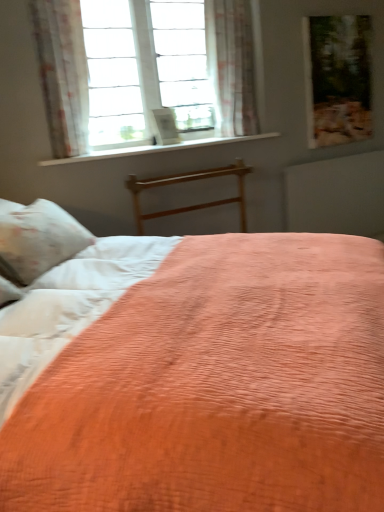
What do you see at coordinates (338, 79) in the screenshot? The height and width of the screenshot is (512, 384). I see `wooden picture frame at upper right` at bounding box center [338, 79].

Describe the element at coordinates (232, 65) in the screenshot. I see `sheer floral fabric at upper center, arranged as the 1th curtain when viewed from the right` at that location.

The width and height of the screenshot is (384, 512). Describe the element at coordinates (336, 192) in the screenshot. I see `coral quilted bed at center` at that location.

What do you see at coordinates (154, 149) in the screenshot? The height and width of the screenshot is (512, 384). I see `white smooth window sill at upper center` at bounding box center [154, 149].

Identify the location of wooden picture frame at upper right. (x=338, y=79).

Is sheer floral fabric at upper center, marked as the 2th curtain in a front-to-back arrangement, positioned with its back to matte wood radiator at upper right?

sheer floral fabric at upper center, marked as the 2th curtain in a front-to-back arrangement, does not have its back to matte wood radiator at upper right.

Between sheer floral fabric at upper center, arranged as the 1th curtain when viewed from the right, and matte wood radiator at upper right, which one appears on the right side from the viewer's perspective?

Positioned to the right is matte wood radiator at upper right.

Find the location of a particular element. This screenshot has height=512, width=384. radiator that appears below the sheer floral fabric at upper center, arranged as the 1th curtain when viewed from the right (from a real-world perspective) is located at coordinates (337, 195).

Is point (234, 124) more distant than point (366, 181)?

No.

Is coral quilted bed at center not near wooden bed frame at center?

No, there isn't a large distance between coral quilted bed at center and wooden bed frame at center.

Consider the image. How different are the orientations of coral quilted bed at center and wooden bed frame at center in degrees?

There is a 45.7-degree angle between the facing directions of coral quilted bed at center and wooden bed frame at center.

From the image's perspective, is coral quilted bed at center located beneath wooden bed frame at center?

Correct, coral quilted bed at center appears lower than wooden bed frame at center in the image.

Is coral quilted bed at center bigger than wooden bed frame at center?

Indeed, coral quilted bed at center has a larger size compared to wooden bed frame at center.

Could you measure the distance between matte wood radiator at upper right and sheer floral fabric at upper center, placed as the 1th curtain when sorted from back to front?

A distance of 34.43 inches exists between matte wood radiator at upper right and sheer floral fabric at upper center, placed as the 1th curtain when sorted from back to front.

Does point (297, 166) come behind point (227, 115)?

Yes, point (297, 166) is farther from viewer.

How many degrees apart are the facing directions of matte wood radiator at upper right and sheer floral fabric at upper center, which is counted as the 2th curtain, starting from the left?

The angular difference between matte wood radiator at upper right and sheer floral fabric at upper center, which is counted as the 2th curtain, starting from the left, is 0.00337 degrees.

Considering the relative sizes of matte wood radiator at upper right and sheer floral fabric at upper center, placed as the 1th curtain when sorted from back to front, in the image provided, is matte wood radiator at upper right thinner than sheer floral fabric at upper center, placed as the 1th curtain when sorted from back to front,?

Correct, the width of matte wood radiator at upper right is less than that of sheer floral fabric at upper center, placed as the 1th curtain when sorted from back to front.

Does matte wood radiator at upper right touch floral sheer curtain at upper left, which is the 2th curtain in right-to-left order?

No.

Is point (306, 208) closer to viewer compared to point (67, 60)?

No.

From the picture: Does matte wood radiator at upper right come in front of floral sheer curtain at upper left, which is the first curtain from front to back?

No, matte wood radiator at upper right is behind floral sheer curtain at upper left, which is the first curtain from front to back.

Is white smooth window sill at upper center not close to matte wood radiator at upper right?

No, white smooth window sill at upper center is in close proximity to matte wood radiator at upper right.

Can you confirm if white smooth window sill at upper center is positioned to the right of matte wood radiator at upper right?

Incorrect, white smooth window sill at upper center is not on the right side of matte wood radiator at upper right.

Is white smooth window sill at upper center turned away from matte wood radiator at upper right?

No.

Is wooden bed frame at center completely or partially inside floral sheer curtain at upper left, which is counted as the second curtain, starting from the back?

No, wooden bed frame at center is not surrounded by floral sheer curtain at upper left, which is counted as the second curtain, starting from the back.

In the scene shown: Is floral sheer curtain at upper left, which is the 2th curtain in right-to-left order, to the left or to the right of wooden bed frame at center in the image?

Clearly, floral sheer curtain at upper left, which is the 2th curtain in right-to-left order, is on the left of wooden bed frame at center in the image.

Looking at this image, from a real-world perspective, is floral sheer curtain at upper left, which is the 2th curtain in right-to-left order, on top of wooden bed frame at center?

Yes, from a real-world perspective, floral sheer curtain at upper left, which is the 2th curtain in right-to-left order, is on top of wooden bed frame at center.

Locate an element on the screen. The image size is (384, 512). bed frame below the floral sheer curtain at upper left, which is the 1th curtain in left-to-right order (from a real-world perspective) is located at coordinates (186, 182).

Is white smooth window sill at upper center shorter than floral sheer curtain at upper left, which is counted as the second curtain, starting from the back?

Yes.

Is white smooth window sill at upper center beside floral sheer curtain at upper left, which is the 2th curtain in right-to-left order?

white smooth window sill at upper center is not next to floral sheer curtain at upper left, which is the 2th curtain in right-to-left order, and they're not touching.

Is point (232, 139) closer or farther from the camera than point (39, 31)?

Clearly, point (232, 139) is more distant from the camera than point (39, 31).

Considering the sizes of objects white smooth window sill at upper center and floral sheer curtain at upper left, which is the first curtain from front to back, in the image provided, who is bigger, white smooth window sill at upper center or floral sheer curtain at upper left, which is the first curtain from front to back,?

floral sheer curtain at upper left, which is the first curtain from front to back, is bigger.

I want to click on radiator behind the sheer floral fabric at upper center, arranged as the 1th curtain when viewed from the right, so click(337, 195).

I want to click on bed above the wooden bed frame at center (from a real-world perspective), so click(x=336, y=192).

Based on their spatial positions, is matte wood radiator at upper right or wooden bed frame at center further from floral sheer curtain at upper left, which is the 2th curtain in right-to-left order?

The object further to floral sheer curtain at upper left, which is the 2th curtain in right-to-left order, is matte wood radiator at upper right.

Considering their positions, is wooden bed frame at center positioned further to sheer floral fabric at upper center, placed as the 1th curtain when sorted from back to front, than coral quilted bed at center?

coral quilted bed at center is positioned further to the anchor sheer floral fabric at upper center, placed as the 1th curtain when sorted from back to front.

Looking at the image, which one is located closer to coral quilted bed at center, white smooth window sill at upper center or floral sheer curtain at upper left, which is counted as the second curtain, starting from the back?

white smooth window sill at upper center is closer to coral quilted bed at center.

From the image, which object appears to be farther from wooden bed frame at center, wooden picture frame at upper right or matte wood radiator at upper right?

wooden picture frame at upper right.

Considering their positions, is wooden bed frame at center positioned further to white smooth window sill at upper center than matte wood radiator at upper right?

matte wood radiator at upper right is further to white smooth window sill at upper center.

From the image, which object appears to be nearer to floral sheer curtain at upper left, which is counted as the second curtain, starting from the back, wooden picture frame at upper right or white smooth window sill at upper center?

Answer: The object closer to floral sheer curtain at upper left, which is counted as the second curtain, starting from the back, is white smooth window sill at upper center.

When comparing their distances from floral sheer curtain at upper left, which is the 2th curtain in right-to-left order, does coral quilted bed at center or sheer floral fabric at upper center, marked as the 2th curtain in a front-to-back arrangement, seem closer?

Based on the image, sheer floral fabric at upper center, marked as the 2th curtain in a front-to-back arrangement, appears to be nearer to floral sheer curtain at upper left, which is the 2th curtain in right-to-left order.

From the image, which object appears to be farther from wooden picture frame at upper right, floral sheer curtain at upper left, which is the 2th curtain in right-to-left order, or coral quilted bed at center?

Based on the image, floral sheer curtain at upper left, which is the 2th curtain in right-to-left order, appears to be further to wooden picture frame at upper right.

Find the location of `curtain positioned between coral quilted bed at center and sheer floral fabric at upper center, placed as the 1th curtain when sorted from back to front, from near to far`. curtain positioned between coral quilted bed at center and sheer floral fabric at upper center, placed as the 1th curtain when sorted from back to front, from near to far is located at coordinates (62, 73).

At what (x,y) coordinates should I click in order to perform the action: click on window sill between sheer floral fabric at upper center, arranged as the 1th curtain when viewed from the right, and wooden bed frame at center, in the vertical direction. Please return your answer as a coordinate pair (x, y). Image resolution: width=384 pixels, height=512 pixels. Looking at the image, I should click on (154, 149).

Locate an element on the screen. The image size is (384, 512). curtain located between coral quilted bed at center and wooden bed frame at center in the depth direction is located at coordinates (62, 73).

Where is `window sill located between floral sheer curtain at upper left, which is counted as the second curtain, starting from the back, and wooden picture frame at upper right in the left-right direction`? The width and height of the screenshot is (384, 512). window sill located between floral sheer curtain at upper left, which is counted as the second curtain, starting from the back, and wooden picture frame at upper right in the left-right direction is located at coordinates (154, 149).